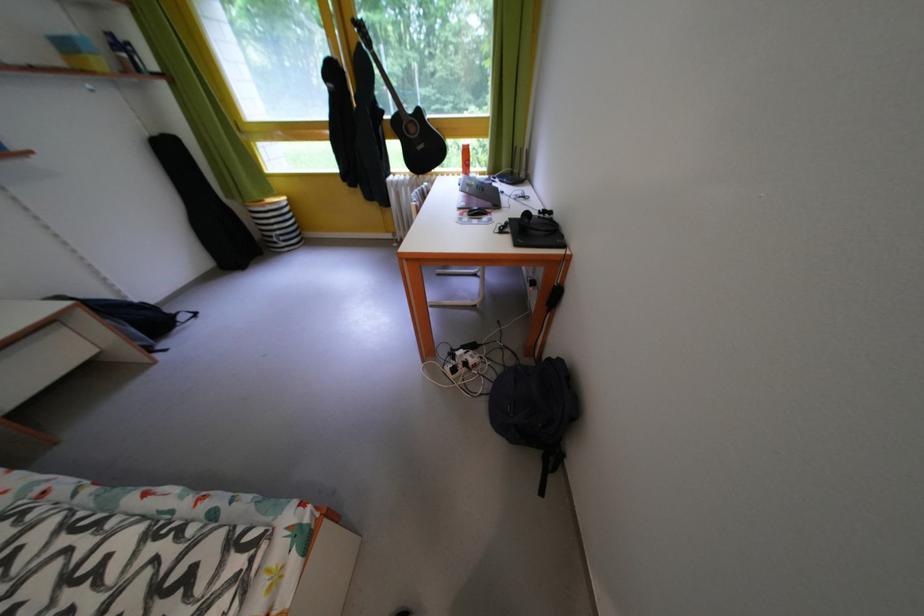
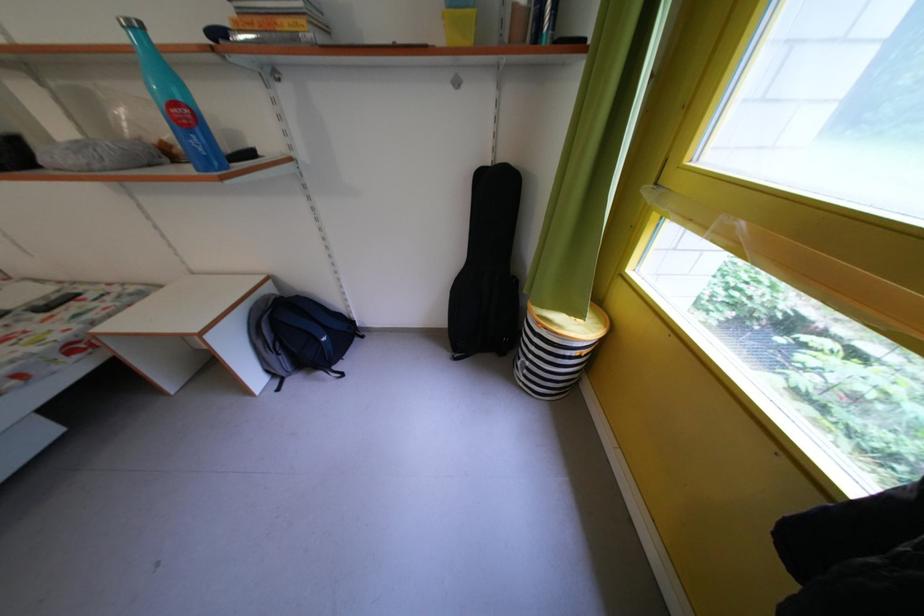
In the second image, find the point that corresponds to pixel 287 238 in the first image.

(537, 369)